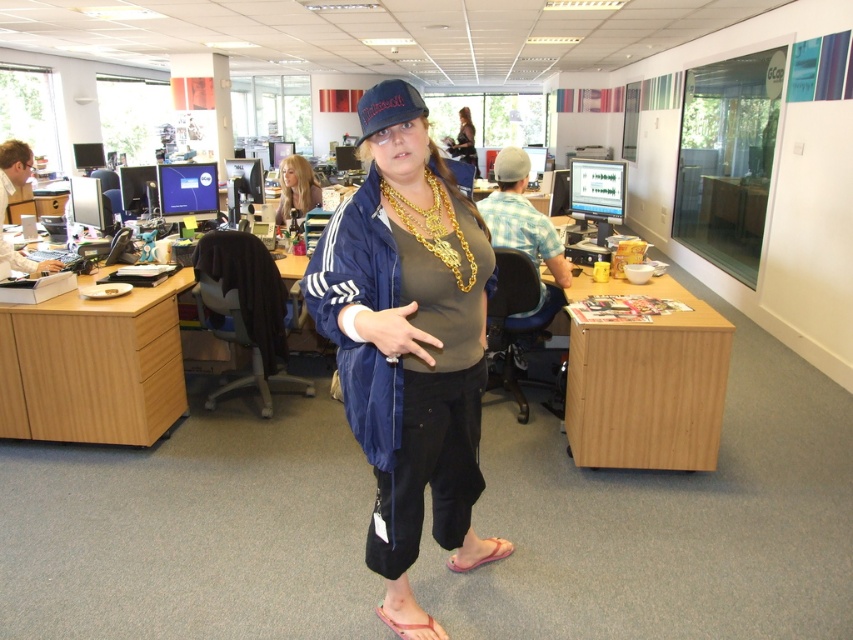
You are a tailor measuring items for alterations. You have a gray fabric baseball cap at center and a matte black dress at center. Which item has a smaller width that might require a different alteration technique?

The gray fabric baseball cap at center has a smaller width than the matte black dress at center, so it might require a different alteration technique.